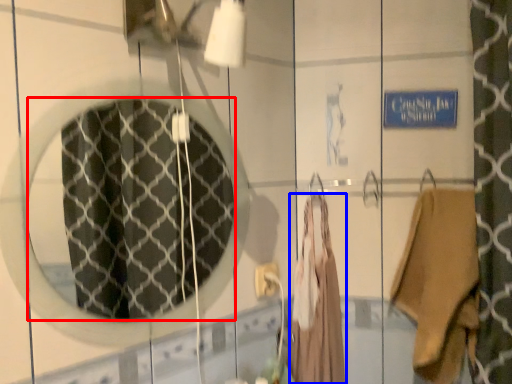
Question: Which of the following is the farthest to the observer, mirror (highlighted by a red box) or clothing (highlighted by a blue box)?

Choices:
 (A) mirror
 (B) clothing

Answer: (B)